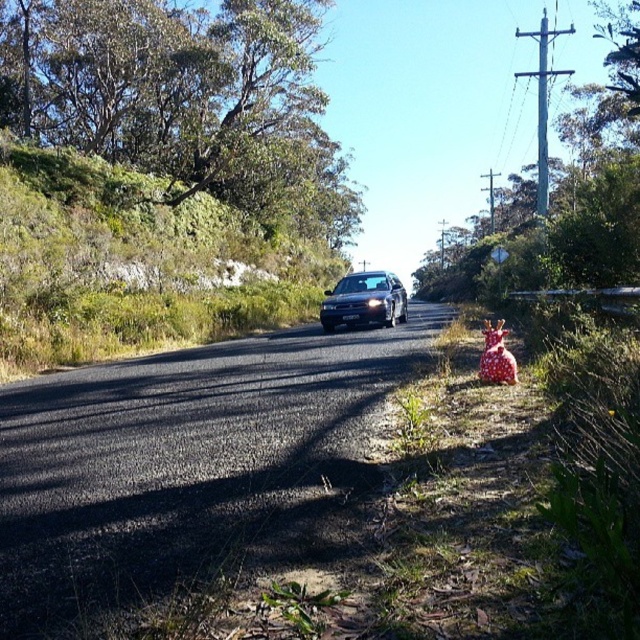
Question: Which point is farther to the camera?

Choices:
 (A) satin black sedan at center
 (B) black asphalt road at center

Answer: (A)

Question: Is black asphalt road at center smaller than satin black sedan at center?

Choices:
 (A) no
 (B) yes

Answer: (B)

Question: Where is black asphalt road at center located in relation to satin black sedan at center in the image?

Choices:
 (A) above
 (B) below

Answer: (B)

Question: Can you confirm if black asphalt road at center is positioned above satin black sedan at center?

Choices:
 (A) no
 (B) yes

Answer: (A)

Question: Which point is farther to the camera?

Choices:
 (A) (365, 298)
 (B) (12, 604)

Answer: (A)

Question: Which point appears closest to the camera in this image?

Choices:
 (A) (349, 476)
 (B) (326, 310)

Answer: (A)